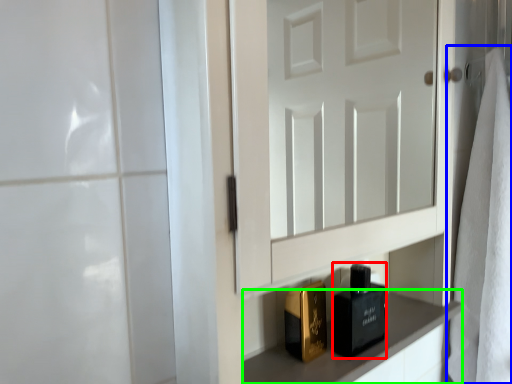
Question: Which is nearer to the perfume (highlighted by a red box)? bath towel (highlighted by a blue box) or cabinetry (highlighted by a green box).

Choices:
 (A) bath towel
 (B) cabinetry

Answer: (B)